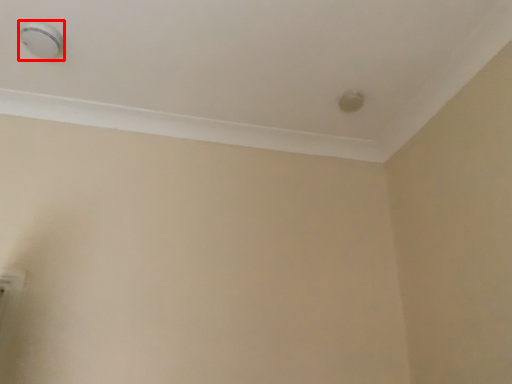
Question: In this image, where is knob (annotated by the red box) located relative to knob?

Choices:
 (A) right
 (B) left

Answer: (B)